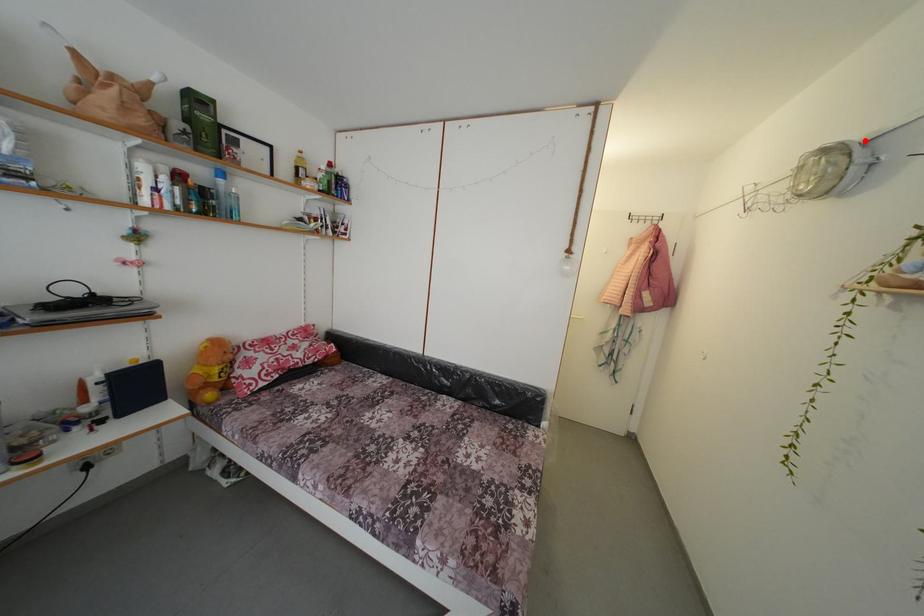
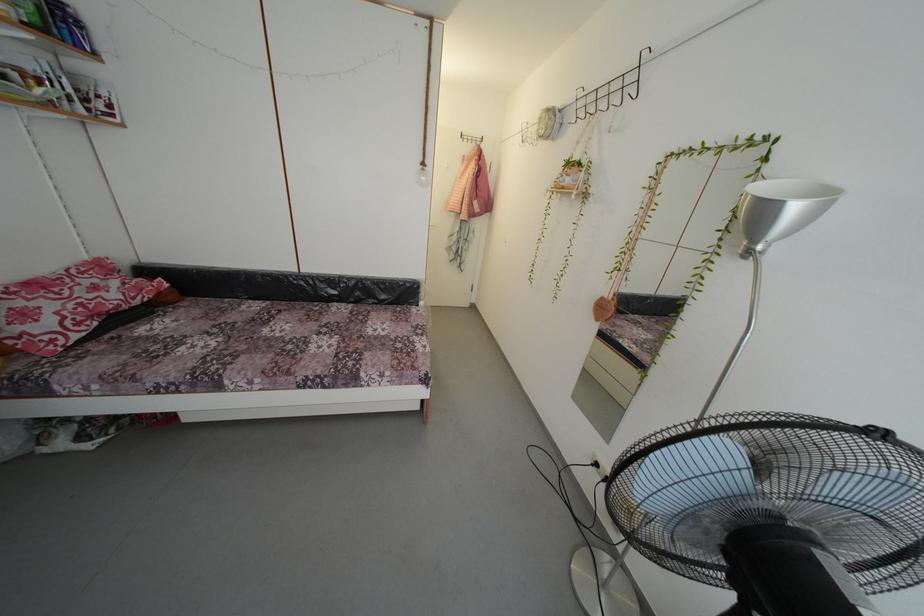
Where in the second image is the point corresponding to the highlighted location from the first image?

(564, 111)